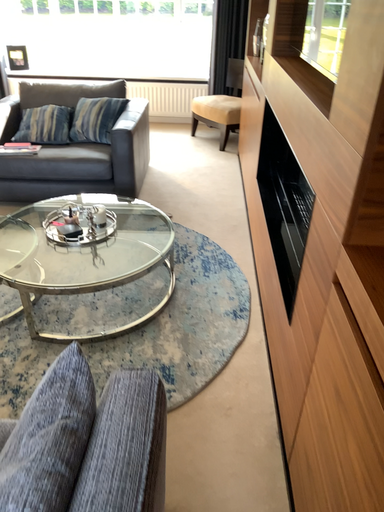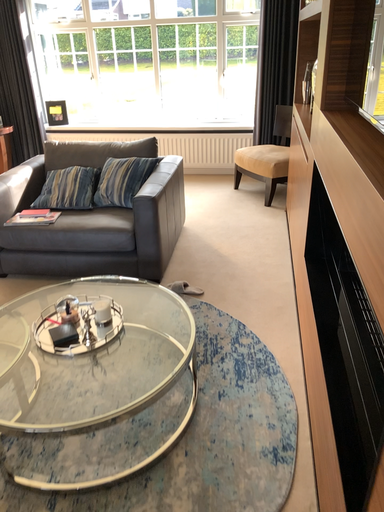
Question: Which way did the camera rotate in the video?

Choices:
 (A) rotated right
 (B) rotated left

Answer: (B)